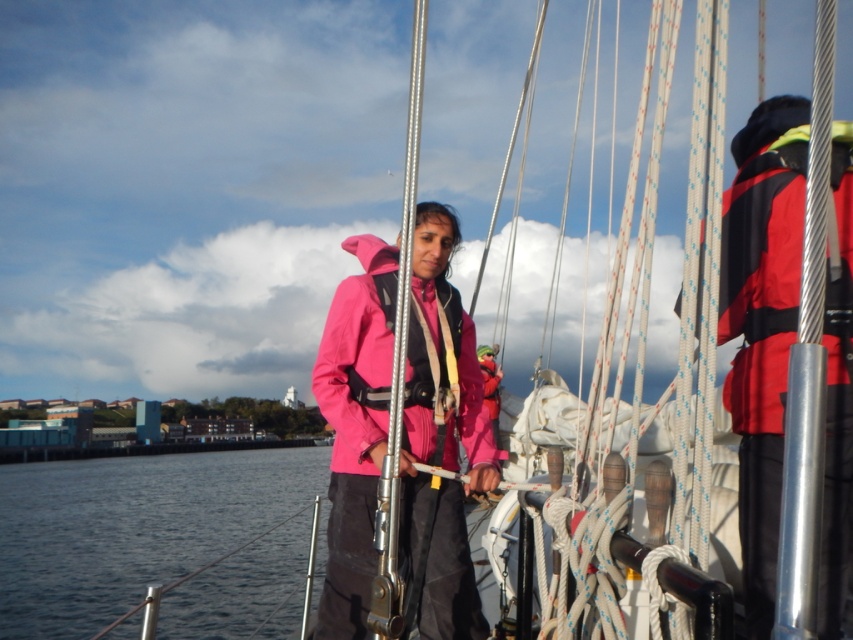
Question: Which point is closer to the camera?

Choices:
 (A) (384, 342)
 (B) (735, 234)

Answer: (B)

Question: Observing the image, what is the correct spatial positioning of dark blue water at lower left in reference to matte pink jacket at center?

Choices:
 (A) left
 (B) right

Answer: (A)

Question: Which object appears farthest from the camera in this image?

Choices:
 (A) dark blue water at lower left
 (B) matte pink jacket at center

Answer: (A)

Question: Which point is farther to the camera?

Choices:
 (A) dark blue water at lower left
 (B) red synthetic jacket at right

Answer: (A)

Question: Can you confirm if dark blue water at lower left is thinner than matte pink jacket at center?

Choices:
 (A) yes
 (B) no

Answer: (B)

Question: Is dark blue water at lower left above matte pink jacket at center?

Choices:
 (A) yes
 (B) no

Answer: (B)